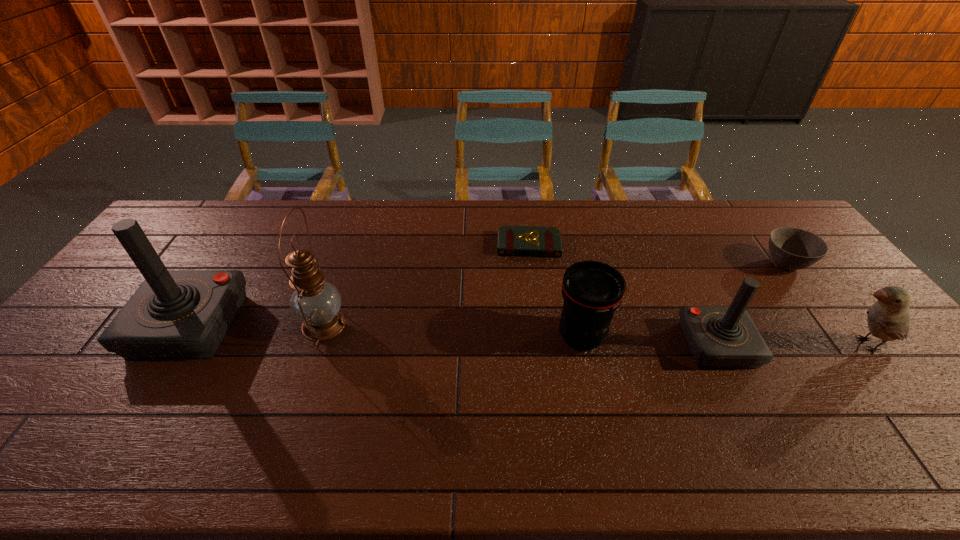
The height and width of the screenshot is (540, 960). I want to click on the taller joystick, so click(175, 314).

Locate an element on the screen. The width and height of the screenshot is (960, 540). the left joystick is located at coordinates (175, 314).

Locate an element on the screen. The height and width of the screenshot is (540, 960). the right joystick is located at coordinates (718, 336).

In order to click on the third object from right to left in this screenshot , I will do `click(718, 336)`.

Locate an element on the screen. This screenshot has height=540, width=960. the second shortest object is located at coordinates (x=791, y=248).

You are a GUI agent. You are given a task and a screenshot of the screen. Output one action in this format:
    pyautogui.click(x=<x>, y=<y>)
    Task: Click on the oil lamp
    Image resolution: width=960 pixels, height=540 pixels.
    Given the screenshot: What is the action you would take?
    pyautogui.click(x=315, y=302)

Find the location of `the shortest object`. the shortest object is located at coordinates (512, 240).

In order to click on telephoto lens in this screenshot , I will do [592, 291].

Identify the location of bird. (889, 318).

The height and width of the screenshot is (540, 960). I want to click on free spot located 0.050m on the rectangular base of the third object from right to left, so click(x=738, y=388).